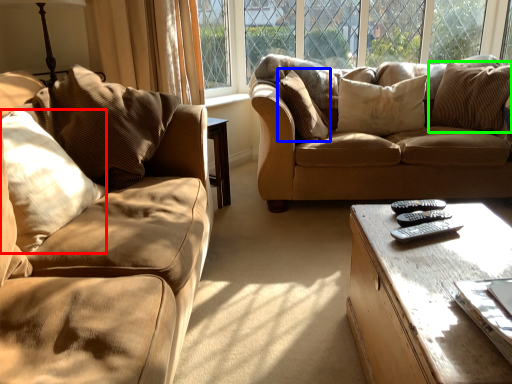
Question: Considering the real-world distances, which object is closest to pillow (highlighted by a red box)? pillow (highlighted by a blue box) or pillow (highlighted by a green box).

Choices:
 (A) pillow
 (B) pillow

Answer: (A)